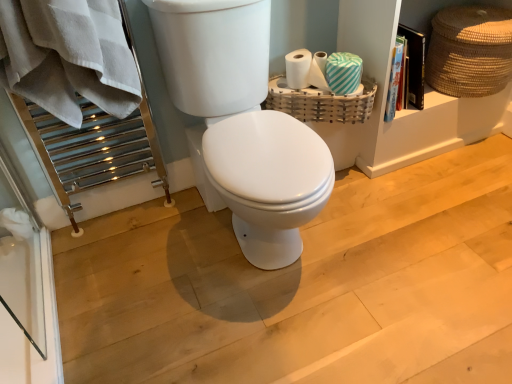
What is the approximate width of white glossy toilet at center?

It is 27.68 inches.

Measure the distance between braided straw basket at upper right, the 2th basket viewed from the left, and camera.

The depth of braided straw basket at upper right, the 2th basket viewed from the left, is 1.53 meters.

Measure the distance between point (313, 80) and camera.

5.02 feet.

Measure the distance between white textured toilet paper at upper right, acting as the second toilet paper starting from the right, and camera.

They are 1.50 meters apart.

This screenshot has height=384, width=512. Identify the location of white cotton bath towel at left. (68, 56).

Where is `white glossy toilet at center`? The image size is (512, 384). white glossy toilet at center is located at coordinates (243, 123).

Can we say teal striped toilet paper at upper right, marked as the second toilet paper in a left-to-right arrangement, lies outside woven bamboo basket at upper right, which is the 1th basket from left to right?

Absolutely, teal striped toilet paper at upper right, marked as the second toilet paper in a left-to-right arrangement, is external to woven bamboo basket at upper right, which is the 1th basket from left to right.

How many degrees apart are the facing directions of teal striped toilet paper at upper right, marked as the second toilet paper in a left-to-right arrangement, and woven bamboo basket at upper right, which is counted as the 2th basket, starting from the right?

Answer: They differ by 35.2 degrees in their facing directions.

Is teal striped toilet paper at upper right, marked as the second toilet paper in a left-to-right arrangement, facing towards woven bamboo basket at upper right, which is counted as the 2th basket, starting from the right?

No, teal striped toilet paper at upper right, marked as the second toilet paper in a left-to-right arrangement, is not turned towards woven bamboo basket at upper right, which is counted as the 2th basket, starting from the right.

Where is `toilet paper that is the 1st object located above the woven bamboo basket at upper right, which is the 1th basket from left to right (from the image's perspective)`? Image resolution: width=512 pixels, height=384 pixels. toilet paper that is the 1st object located above the woven bamboo basket at upper right, which is the 1th basket from left to right (from the image's perspective) is located at coordinates (319, 70).

From a real-world perspective, relative to teal striped toilet paper at upper right, marked as the second toilet paper in a left-to-right arrangement, is woven bamboo basket at upper right, which is counted as the 2th basket, starting from the right, vertically above or below?

woven bamboo basket at upper right, which is counted as the 2th basket, starting from the right, is situated lower than teal striped toilet paper at upper right, marked as the second toilet paper in a left-to-right arrangement, in the real world.

Is woven bamboo basket at upper right, which is the 1th basket from left to right, wider or thinner than teal striped toilet paper at upper right, marked as the second toilet paper in a left-to-right arrangement?

Clearly, woven bamboo basket at upper right, which is the 1th basket from left to right, has more width compared to teal striped toilet paper at upper right, marked as the second toilet paper in a left-to-right arrangement.

Which object is more forward, woven bamboo basket at upper right, which is the 1th basket from left to right, or teal striped toilet paper at upper right, marked as the 1th toilet paper in a right-to-left arrangement?

teal striped toilet paper at upper right, marked as the 1th toilet paper in a right-to-left arrangement, is closer to the camera.

Which is more to the right, woven bamboo basket at upper right, which is the 1th basket from left to right, or teal striped toilet paper at upper right, marked as the second toilet paper in a left-to-right arrangement?

From the viewer's perspective, teal striped toilet paper at upper right, marked as the second toilet paper in a left-to-right arrangement, appears more on the right side.

Which is closer, (x=68, y=34) or (x=260, y=159)?

Point (x=68, y=34) appears to be closer to the viewer than point (x=260, y=159).

Can you confirm if white cotton bath towel at left is thinner than white glossy toilet at center?

Indeed, white cotton bath towel at left has a lesser width compared to white glossy toilet at center.

Does white cotton bath towel at left appear on the left side of white glossy toilet at center?

Indeed, white cotton bath towel at left is positioned on the left side of white glossy toilet at center.

Does woven bamboo basket at upper right, which is counted as the 2th basket, starting from the right, have a lesser width compared to white textured toilet paper at upper right, the 1th toilet paper in the left-to-right sequence?

Incorrect, the width of woven bamboo basket at upper right, which is counted as the 2th basket, starting from the right, is not less than that of white textured toilet paper at upper right, the 1th toilet paper in the left-to-right sequence.

Is point (304, 113) farther from camera compared to point (319, 53)?

That is False.

Is woven bamboo basket at upper right, which is the 1th basket from left to right, in front of or behind white textured toilet paper at upper right, the 1th toilet paper in the left-to-right sequence, in the image?

woven bamboo basket at upper right, which is the 1th basket from left to right, is in front of white textured toilet paper at upper right, the 1th toilet paper in the left-to-right sequence.

Is there a large distance between woven bamboo basket at upper right, which is counted as the 2th basket, starting from the right, and white textured toilet paper at upper right, the 1th toilet paper in the left-to-right sequence?

No, woven bamboo basket at upper right, which is counted as the 2th basket, starting from the right, is not far from white textured toilet paper at upper right, the 1th toilet paper in the left-to-right sequence.

Is white cotton bath towel at left at the back of woven bamboo basket at upper right, which is counted as the 2th basket, starting from the right?

No, woven bamboo basket at upper right, which is counted as the 2th basket, starting from the right, is not facing the opposite direction of white cotton bath towel at left.

Which point is more distant from viewer, [293,94] or [0,80]?

The point [293,94] is farther from the camera.

Based on the photo, which is behind, woven bamboo basket at upper right, which is counted as the 2th basket, starting from the right, or white cotton bath towel at left?

woven bamboo basket at upper right, which is counted as the 2th basket, starting from the right.

Consider the image. Is white glossy toilet at center next to white cotton bath towel at left?

No, white glossy toilet at center is not making contact with white cotton bath towel at left.

Which object is thinner, white glossy toilet at center or white cotton bath towel at left?

With smaller width is white cotton bath towel at left.

Does point (300, 152) come in front of point (8, 36)?

No.

From a real-world perspective, which object stands above the other?

white cotton bath towel at left is physically above.

Is teal striped toilet paper at upper right, marked as the 1th toilet paper in a right-to-left arrangement, next to white textured toilet paper at upper right, acting as the second toilet paper starting from the right, and touching it?

Yes, teal striped toilet paper at upper right, marked as the 1th toilet paper in a right-to-left arrangement, is in contact with white textured toilet paper at upper right, acting as the second toilet paper starting from the right.

Does teal striped toilet paper at upper right, marked as the second toilet paper in a left-to-right arrangement, have a lesser height compared to white textured toilet paper at upper right, the 1th toilet paper in the left-to-right sequence?

Indeed, teal striped toilet paper at upper right, marked as the second toilet paper in a left-to-right arrangement, has a lesser height compared to white textured toilet paper at upper right, the 1th toilet paper in the left-to-right sequence.

Would you say teal striped toilet paper at upper right, marked as the second toilet paper in a left-to-right arrangement, is outside white textured toilet paper at upper right, acting as the second toilet paper starting from the right?

Yes, teal striped toilet paper at upper right, marked as the second toilet paper in a left-to-right arrangement, is outside of white textured toilet paper at upper right, acting as the second toilet paper starting from the right.

Between point (332, 87) and point (318, 77), which one is positioned behind?

The point (318, 77) is farther from the camera.

Where is `basket on the left side of teal striped toilet paper at upper right, marked as the 1th toilet paper in a right-to-left arrangement`? This screenshot has width=512, height=384. basket on the left side of teal striped toilet paper at upper right, marked as the 1th toilet paper in a right-to-left arrangement is located at coordinates (320, 102).

This screenshot has height=384, width=512. I want to click on basket that is below the teal striped toilet paper at upper right, marked as the 1th toilet paper in a right-to-left arrangement (from the image's perspective), so click(x=320, y=102).

Based on their spatial positions, is white textured toilet paper at upper right, the 1th toilet paper in the left-to-right sequence, or woven bamboo basket at upper right, which is counted as the 2th basket, starting from the right, further from white glossy toilet at center?

The object further to white glossy toilet at center is white textured toilet paper at upper right, the 1th toilet paper in the left-to-right sequence.

Based on their spatial positions, is white textured toilet paper at upper right, the 1th toilet paper in the left-to-right sequence, or white cotton bath towel at left further from braided straw basket at upper right, which is the 1th basket in right-to-left order?

white cotton bath towel at left.

When comparing their distances from white textured toilet paper at upper right, acting as the second toilet paper starting from the right, does white cotton bath towel at left or braided straw basket at upper right, the 2th basket viewed from the left, seem further?

Based on the image, white cotton bath towel at left appears to be further to white textured toilet paper at upper right, acting as the second toilet paper starting from the right.

Considering their positions, is white cotton bath towel at left positioned closer to braided straw basket at upper right, which is the 1th basket in right-to-left order, than white textured toilet paper at upper right, the 1th toilet paper in the left-to-right sequence?

Based on the image, white textured toilet paper at upper right, the 1th toilet paper in the left-to-right sequence, appears to be nearer to braided straw basket at upper right, which is the 1th basket in right-to-left order.

Based on their spatial positions, is braided straw basket at upper right, the 2th basket viewed from the left, or woven bamboo basket at upper right, which is the 1th basket from left to right, closer to white cotton bath towel at left?

Based on the image, woven bamboo basket at upper right, which is the 1th basket from left to right, appears to be nearer to white cotton bath towel at left.

Estimate the real-world distances between objects in this image. Which object is closer to braided straw basket at upper right, which is the 1th basket in right-to-left order, white textured toilet paper at upper right, acting as the second toilet paper starting from the right, or white glossy toilet at center?

white textured toilet paper at upper right, acting as the second toilet paper starting from the right, is closer to braided straw basket at upper right, which is the 1th basket in right-to-left order.

When comparing their distances from white textured toilet paper at upper right, acting as the second toilet paper starting from the right, does white glossy toilet at center or woven bamboo basket at upper right, which is counted as the 2th basket, starting from the right, seem further?

The object further to white textured toilet paper at upper right, acting as the second toilet paper starting from the right, is white glossy toilet at center.

From the image, which object appears to be nearer to white cotton bath towel at left, white textured toilet paper at upper right, acting as the second toilet paper starting from the right, or white glossy toilet at center?

white glossy toilet at center is positioned closer to the anchor white cotton bath towel at left.

Identify the location of toilet paper between woven bamboo basket at upper right, which is the 1th basket from left to right, and braided straw basket at upper right, the 2th basket viewed from the left. This screenshot has height=384, width=512. (319, 70).

Find the location of `basket between white cotton bath towel at left and braided straw basket at upper right, which is the 1th basket in right-to-left order`. basket between white cotton bath towel at left and braided straw basket at upper right, which is the 1th basket in right-to-left order is located at coordinates click(x=320, y=102).

At what (x,y) coordinates should I click in order to perform the action: click on basket located between white glossy toilet at center and braided straw basket at upper right, which is the 1th basket in right-to-left order, in the left-right direction. Please return your answer as a coordinate pair (x, y). Image resolution: width=512 pixels, height=384 pixels. Looking at the image, I should click on (320, 102).

At what (x,y) coordinates should I click in order to perform the action: click on toilet paper between white textured toilet paper at upper right, the 1th toilet paper in the left-to-right sequence, and braided straw basket at upper right, which is the 1th basket in right-to-left order. Please return your answer as a coordinate pair (x, y). The width and height of the screenshot is (512, 384). Looking at the image, I should click on (319, 70).